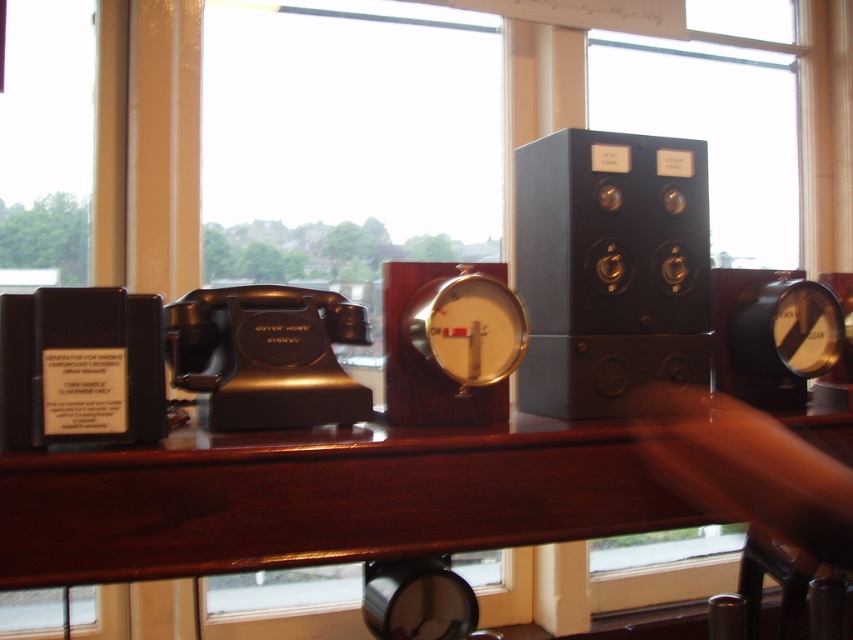
Describe the element at coordinates (413, 492) in the screenshot. The width and height of the screenshot is (853, 640). I see `mahogany wood table at center` at that location.

Consider the image. Is mahogany wood table at center shorter than black matte speaker at center?

Correct, mahogany wood table at center is not as tall as black matte speaker at center.

Who is more distant from viewer, (x=335, y=544) or (x=532, y=364)?

Point (x=532, y=364)

This screenshot has width=853, height=640. What are the coordinates of `mahogany wood table at center` in the screenshot? It's located at (413, 492).